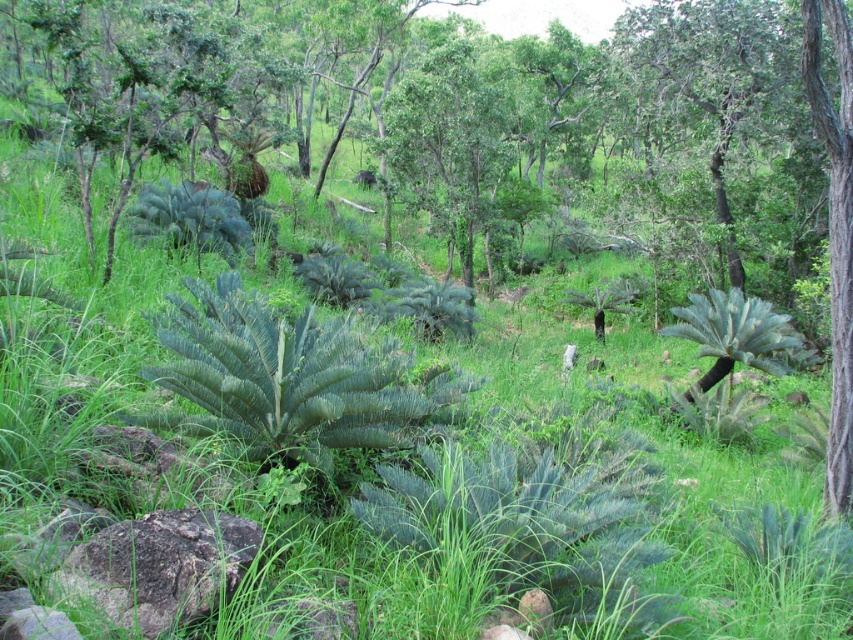
Between green fibrous fern at center and gray rough rock at lower left, which one appears on the left side from the viewer's perspective?

From the viewer's perspective, green fibrous fern at center appears more on the left side.

Does green fibrous fern at center come in front of gray rough rock at lower left?

No.

This screenshot has width=853, height=640. What are the coordinates of `green fibrous fern at center` in the screenshot? It's located at (287, 378).